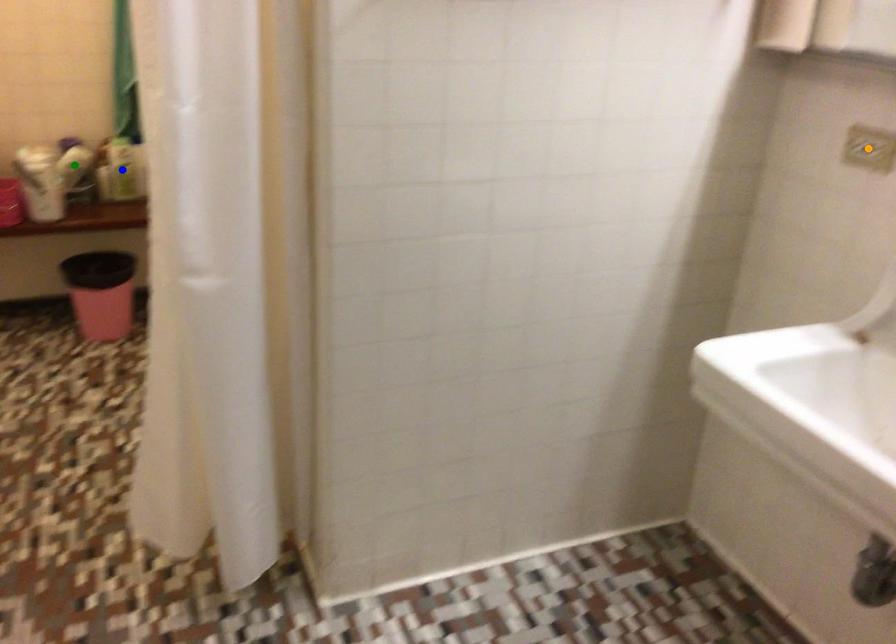
Order these from nearest to farthest:
A) orange point
B) blue point
C) green point

blue point → green point → orange point